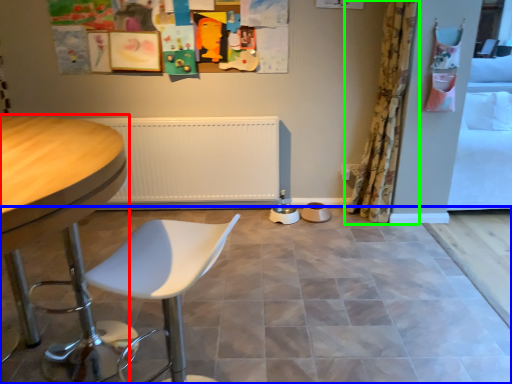
Question: Which object is positioned closest to table (highlighted by a red box)? Select from ceramic tile (highlighted by a blue box) and curtain (highlighted by a green box).

Choices:
 (A) ceramic tile
 (B) curtain

Answer: (A)